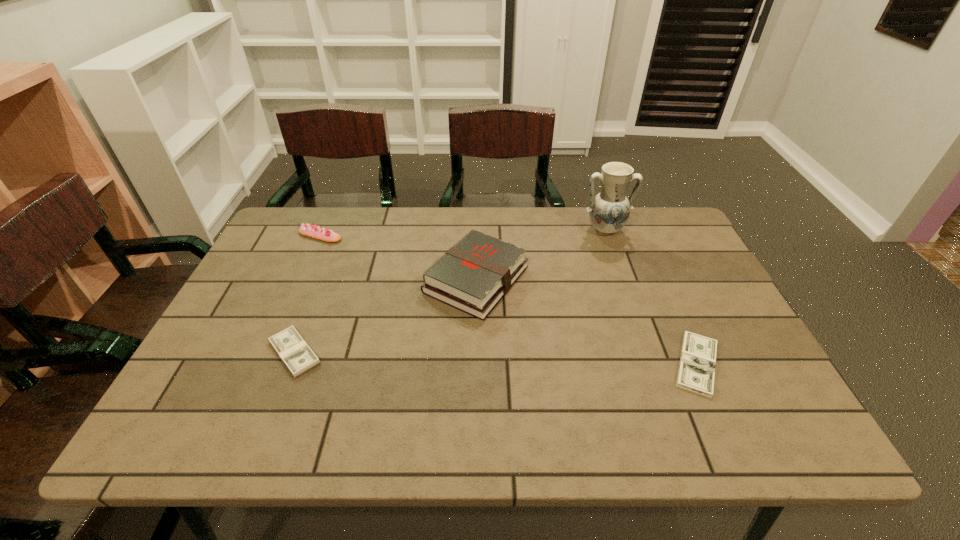
Locate an element on the screen. the tallest object is located at coordinates (609, 210).

This screenshot has height=540, width=960. Find the location of `hardback book`. hardback book is located at coordinates [x=473, y=276].

Identify the location of the third farthest object. This screenshot has height=540, width=960. (473, 276).

Identify the location of the third shortest object. The image size is (960, 540). (309, 230).

At what (x,y) coordinates should I click in order to perform the action: click on the left dollar. Please return your answer as a coordinate pair (x, y). Looking at the image, I should click on (298, 357).

You are a GUI agent. You are given a task and a screenshot of the screen. Output one action in this format:
    pyautogui.click(x=<x>, y=<y>)
    Task: Click on the taller dollar
    Image resolution: width=960 pixels, height=540 pixels.
    Given the screenshot: What is the action you would take?
    pyautogui.click(x=298, y=357)

The height and width of the screenshot is (540, 960). Identify the location of the shortest object. point(696,373).

At what (x,y) coordinates should I click in order to perform the action: click on the right dollar. Please return your answer as a coordinate pair (x, y). The height and width of the screenshot is (540, 960). Looking at the image, I should click on point(696,373).

In order to click on vacant area situated 0.390m on either side of the pottery in this screenshot , I will do point(643,339).

Where is `free space located 0.360m on the right of the fourth shortest object`? free space located 0.360m on the right of the fourth shortest object is located at coordinates (660, 279).